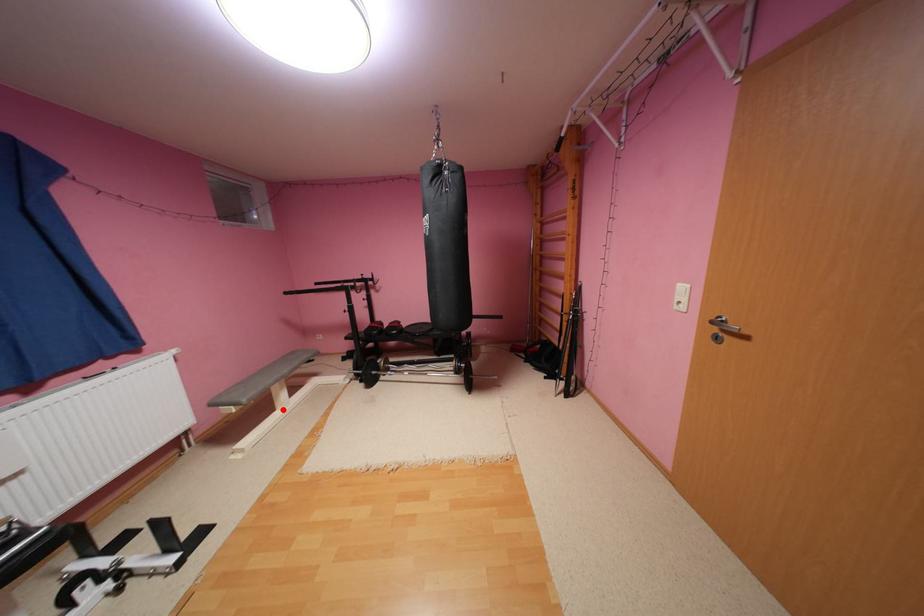
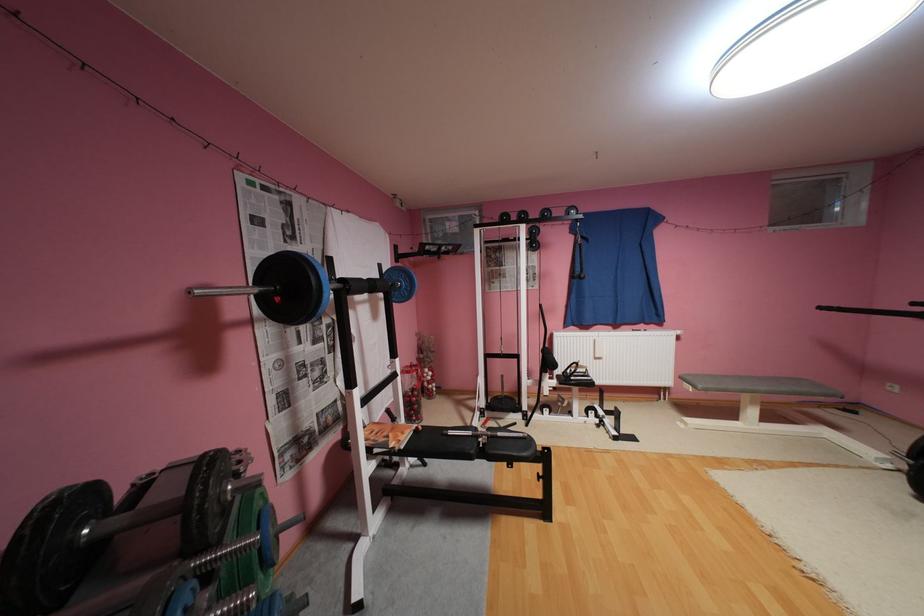
Locate, in the second image, the point that corresponds to the highlighted location in the first image.

(746, 419)